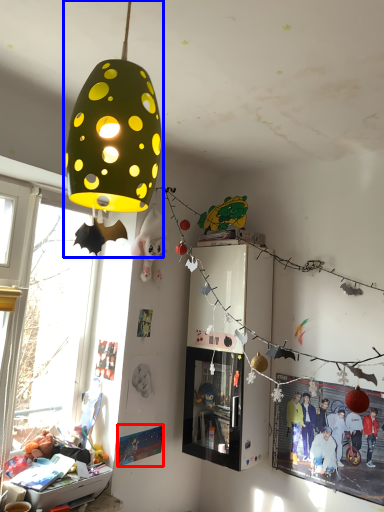
Question: Which point is further to the camera, poster page (highlighted by a red box) or lamp (highlighted by a blue box)?

Choices:
 (A) poster page
 (B) lamp

Answer: (A)